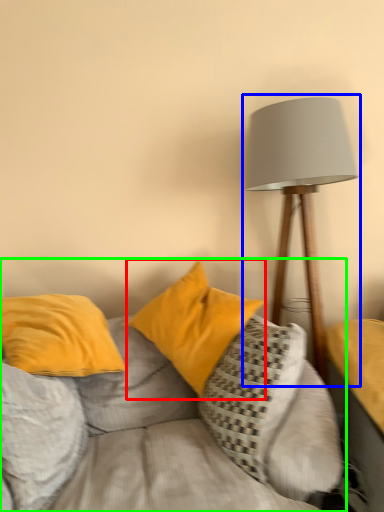
Question: Which object is the closest to the pillow (highlighted by a red box)? Choose among these: lamp (highlighted by a blue box) or studio couch (highlighted by a green box).

Choices:
 (A) lamp
 (B) studio couch

Answer: (B)